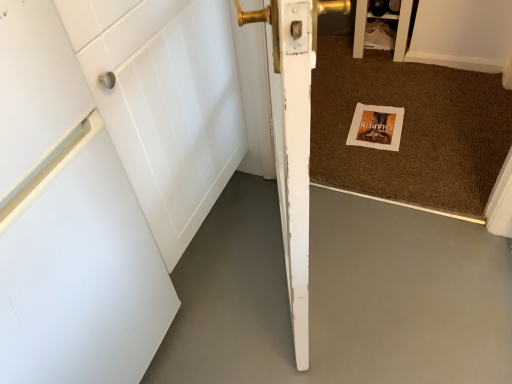
At what (x,y) coordinates should I click in order to perform the action: click on vacant space in front of white matte door at center. Please return your answer as a coordinate pair (x, y). This screenshot has width=512, height=384. Looking at the image, I should click on (321, 337).